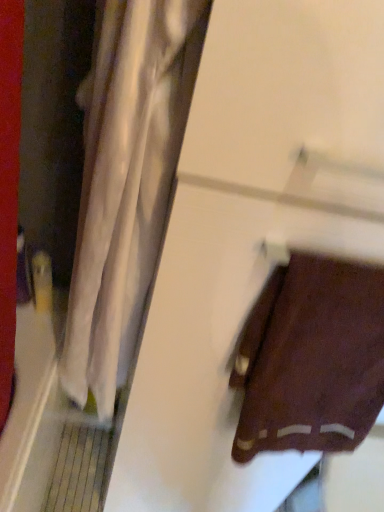
Question: Considering the positions of white sheer curtain at left and brown fabric towel at lower right in the image, is white sheer curtain at left taller or shorter than brown fabric towel at lower right?

Choices:
 (A) short
 (B) tall

Answer: (B)

Question: Considering the positions of point (72, 291) and point (314, 393), is point (72, 291) closer or farther from the camera than point (314, 393)?

Choices:
 (A) farther
 (B) closer

Answer: (B)

Question: Would you say white sheer curtain at left is inside or outside brown fabric towel at lower right?

Choices:
 (A) outside
 (B) inside

Answer: (A)

Question: In terms of height, does brown fabric towel at lower right look taller or shorter compared to white sheer curtain at left?

Choices:
 (A) tall
 (B) short

Answer: (B)

Question: From a real-world perspective, is brown fabric towel at lower right physically located above or below white sheer curtain at left?

Choices:
 (A) below
 (B) above

Answer: (A)

Question: Does point (289, 401) appear closer or farther from the camera than point (97, 93)?

Choices:
 (A) farther
 (B) closer

Answer: (A)

Question: In the image, is brown fabric towel at lower right positioned in front of or behind white sheer curtain at left?

Choices:
 (A) behind
 (B) front

Answer: (A)